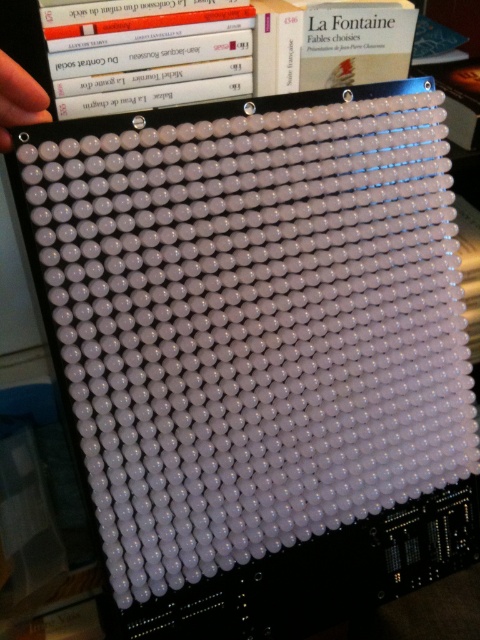
Can you confirm if hardcover book at upper center is positioned to the left of white matte hand at upper left?

In fact, hardcover book at upper center is to the right of white matte hand at upper left.

Between hardcover book at upper center and white matte hand at upper left, which one is positioned higher?

Positioned higher is hardcover book at upper center.

Between point (103, 45) and point (7, 77), which one is positioned in front?

Point (7, 77) is in front.

Image resolution: width=480 pixels, height=640 pixels. In order to click on hardcover book at upper center in this screenshot , I will do `click(227, 52)`.